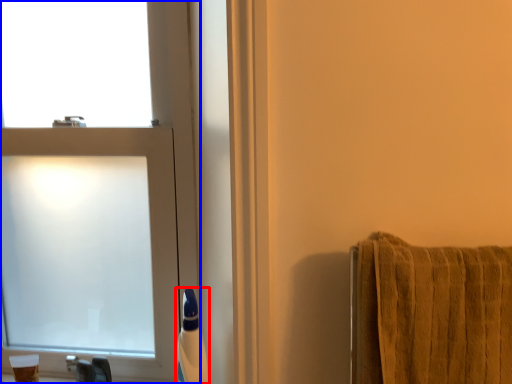
Question: Among these objects, which one is farthest to the camera, toiletry (highlighted by a red box) or window (highlighted by a blue box)?

Choices:
 (A) toiletry
 (B) window

Answer: (B)